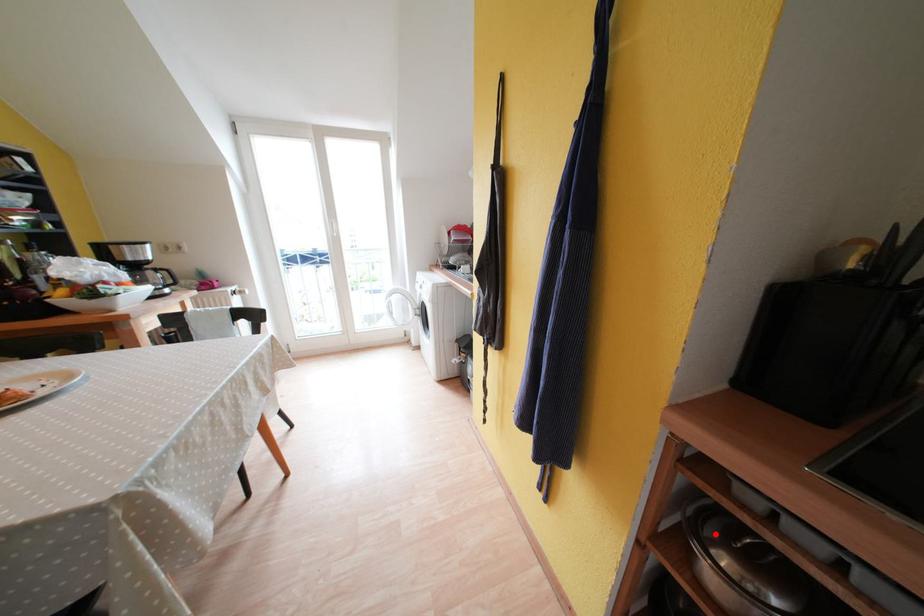
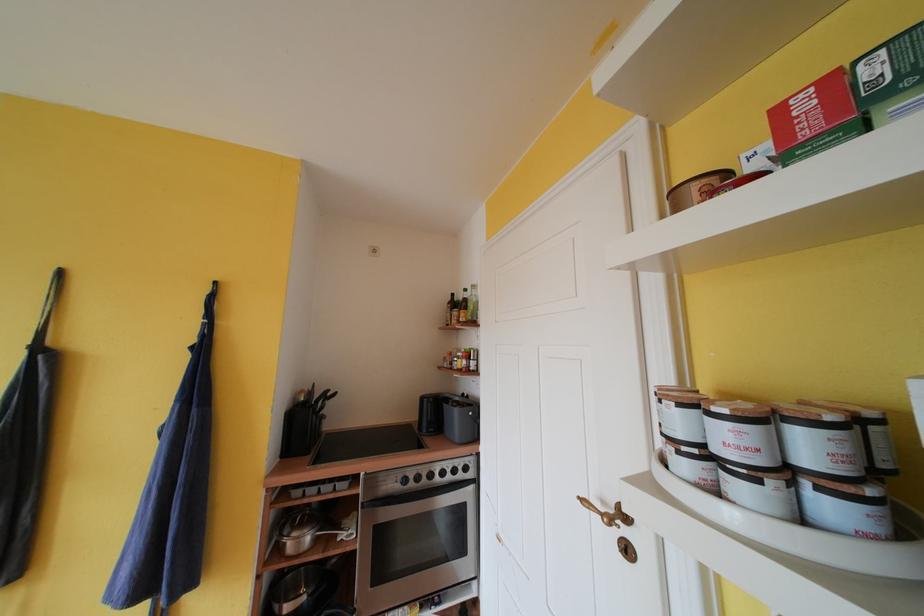
Find the pixel in the second image that matches the highlighted location in the first image.

(293, 535)